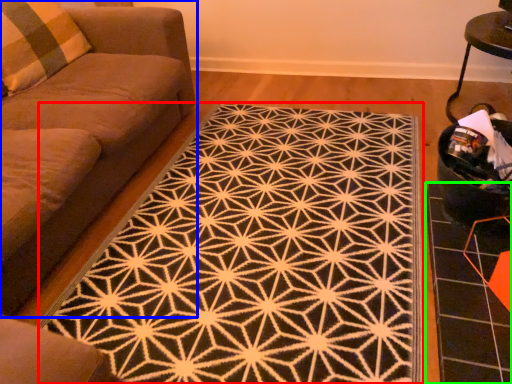
Question: Which object is positioned closest to mat (highlighted by a red box)? Select from studio couch (highlighted by a blue box) and tile (highlighted by a green box).

Choices:
 (A) studio couch
 (B) tile

Answer: (B)